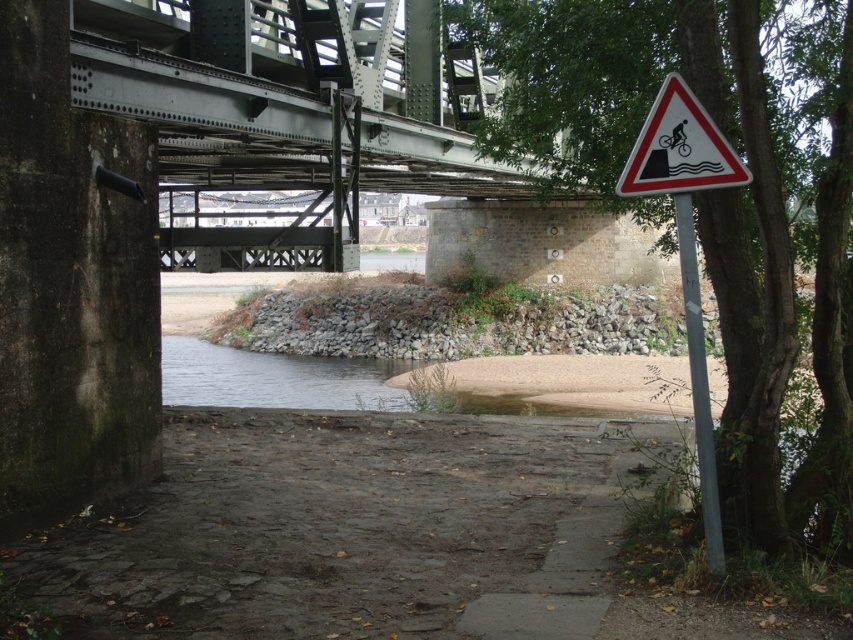
Between point (723, 147) and point (706, 552), which one is positioned behind?

Positioned behind is point (706, 552).

Consider the image. Between white triangular sign with black and red at right and white metallic pole at right, which one appears on the right side from the viewer's perspective?

white metallic pole at right

The width and height of the screenshot is (853, 640). What do you see at coordinates (679, 148) in the screenshot?
I see `white triangular sign with black and red at right` at bounding box center [679, 148].

Identify the location of white triangular sign with black and red at right. (679, 148).

Does white plastic triangle at right appear on the right side of white triangular sign with black and red at right?

Correct, you'll find white plastic triangle at right to the right of white triangular sign with black and red at right.

Who is higher up, white plastic triangle at right or white triangular sign with black and red at right?

white triangular sign with black and red at right

The image size is (853, 640). I want to click on white plastic triangle at right, so click(688, 244).

Locate an element on the screen. The image size is (853, 640). white plastic triangle at right is located at coordinates (688, 244).

Can you confirm if white plastic triangle at right is positioned below white metallic pole at right?

Incorrect, white plastic triangle at right is not positioned below white metallic pole at right.

Does white plastic triangle at right appear on the left side of white metallic pole at right?

Correct, you'll find white plastic triangle at right to the left of white metallic pole at right.

Describe the element at coordinates (688, 244) in the screenshot. I see `white plastic triangle at right` at that location.

What are the coordinates of `white plastic triangle at right` in the screenshot? It's located at (688, 244).